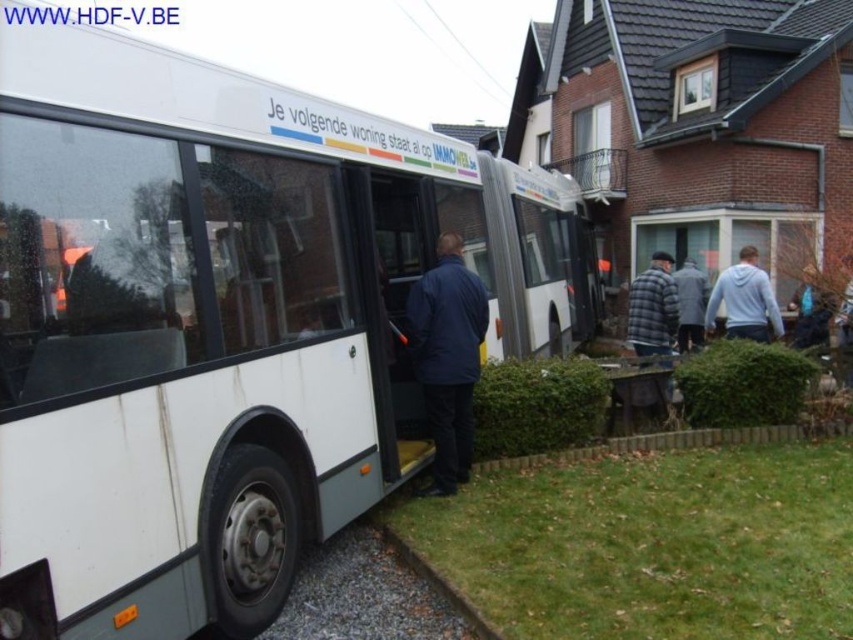
A delivery person needs to place a package between the light gray hoodie at right and the dark gray jacket at center. The package is 30 inches long. Can the package fit in the space between them?

The space between the light gray hoodie at right and the dark gray jacket at center is 33.43 inches, so the 30 inch package can fit as it is shorter than the available space.

You are a person who wants to sit down on the wooden bench at lower right. However, there is a light gray hoodie at right nearby. Can you sit on the bench without the hoodie falling off?

The light gray hoodie at right has a greater height compared to wooden bench at lower right, so it might block access to the bench. Ensure the hoodie is moved or positioned carefully to avoid obstruction before sitting down.